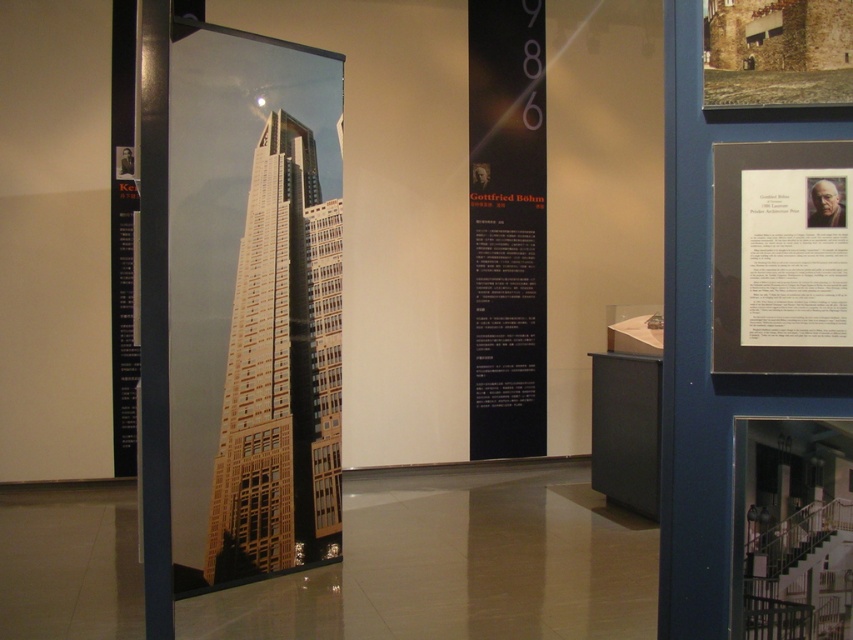
Question: Which object appears closest to the camera in this image?

Choices:
 (A) white paper at upper right
 (B) black matte poster at center

Answer: (A)

Question: Which of the following is the closest to the observer?

Choices:
 (A) matte glass skyscraper at center
 (B) white paper at upper right

Answer: (B)

Question: Can you confirm if matte glass skyscraper at center is positioned to the left of black matte poster at center?

Choices:
 (A) no
 (B) yes

Answer: (B)

Question: Based on their relative distances, which object is nearer to the black matte poster at center?

Choices:
 (A) matte glass skyscraper at center
 (B) white paper at upper right

Answer: (A)

Question: Can you confirm if matte glass skyscraper at center is smaller than black matte poster at center?

Choices:
 (A) yes
 (B) no

Answer: (B)

Question: From the image, what is the correct spatial relationship of matte glass skyscraper at center in relation to black matte poster at center?

Choices:
 (A) right
 (B) left

Answer: (B)